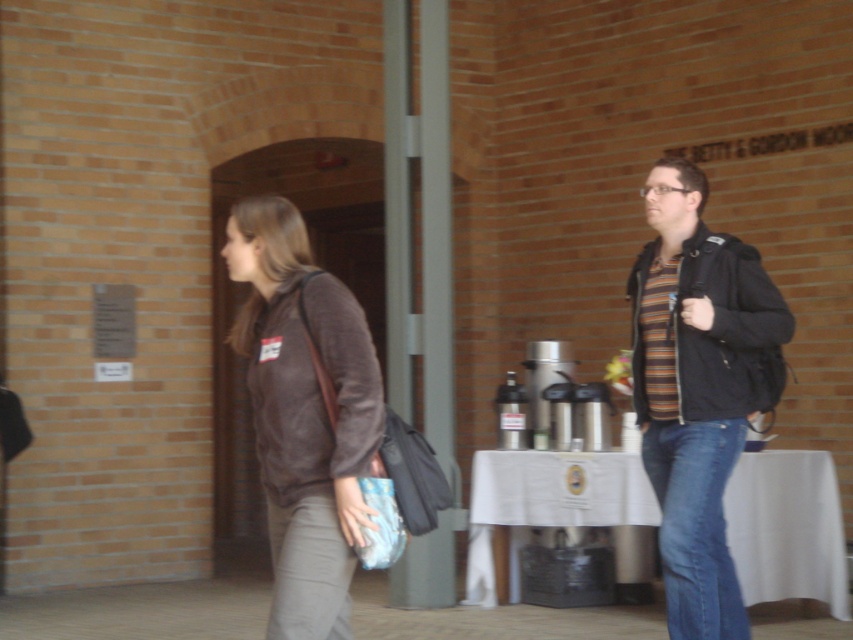
You are standing in front of the brick wall structure with the archway. There are two points marked on the wall. The first point is at coordinates point (775, 339) and the second point is at point (317, 545). Which point is closer to you?

Point (775, 339) is further to the camera than point (317, 545), so the second point is closer to you.